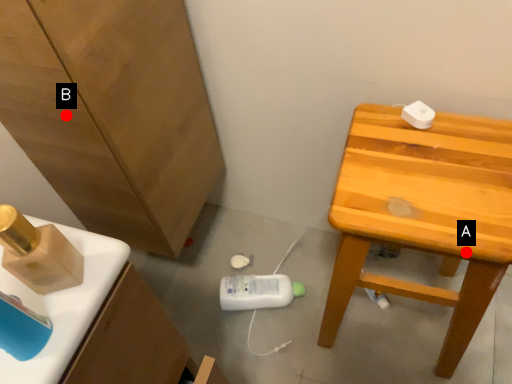
Question: Two points are circled on the image, labeled by A and B beside each circle. Which point is further to the camera?

Choices:
 (A) A is further
 (B) B is further

Answer: (B)